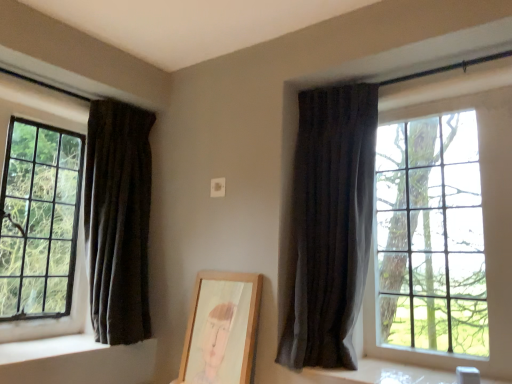
Question: Can you see wooden picture frame at center touching dark fabric curtain at left, which is the second curtain in right-to-left order?

Choices:
 (A) no
 (B) yes

Answer: (A)

Question: Is wooden picture frame at center behind dark fabric curtain at left, arranged as the 1th curtain when viewed from the left?

Choices:
 (A) yes
 (B) no

Answer: (B)

Question: Can you confirm if wooden picture frame at center is taller than dark fabric curtain at left, which is the second curtain in right-to-left order?

Choices:
 (A) yes
 (B) no

Answer: (B)

Question: From a real-world perspective, is wooden picture frame at center over dark fabric curtain at left, arranged as the 1th curtain when viewed from the left?

Choices:
 (A) no
 (B) yes

Answer: (A)

Question: Is wooden picture frame at center far from dark fabric curtain at left, arranged as the 1th curtain when viewed from the left?

Choices:
 (A) yes
 (B) no

Answer: (B)

Question: In the image, is white smooth window sill at lower left, which is the first window sill in left-to-right order, positioned in front of or behind clear glass window at right, the 2th window from the left?

Choices:
 (A) front
 (B) behind

Answer: (B)

Question: From the image's perspective, is white smooth window sill at lower left, which is the first window sill in left-to-right order, located above or below clear glass window at right, the 2th window from the left?

Choices:
 (A) below
 (B) above

Answer: (A)

Question: Do you think white smooth window sill at lower left, placed as the second window sill when sorted from right to left, is within clear glass window at right, the 2th window from the left, or outside of it?

Choices:
 (A) inside
 (B) outside

Answer: (B)

Question: Considering the positions of point (96, 342) and point (487, 97), is point (96, 342) closer or farther from the camera than point (487, 97)?

Choices:
 (A) farther
 (B) closer

Answer: (A)

Question: From their relative heights in the image, would you say white smooth window sill at lower right, the first window sill positioned from the right, is taller or shorter than clear glass window at right, which appears as the 1th window when viewed from the right?

Choices:
 (A) short
 (B) tall

Answer: (A)

Question: Considering their positions, is white smooth window sill at lower right, positioned as the second window sill in left-to-right order, located in front of or behind clear glass window at right, the 2th window from the left?

Choices:
 (A) front
 (B) behind

Answer: (A)

Question: From a real-world perspective, is white smooth window sill at lower right, the first window sill positioned from the right, positioned above or below clear glass window at right, the 2th window from the left?

Choices:
 (A) below
 (B) above

Answer: (A)

Question: Does point (310, 372) appear closer or farther from the camera than point (287, 187)?

Choices:
 (A) closer
 (B) farther

Answer: (A)

Question: Is point (145, 258) closer or farther from the camera than point (376, 112)?

Choices:
 (A) closer
 (B) farther

Answer: (B)

Question: Is dark fabric curtain at left, arranged as the 1th curtain when viewed from the left, inside or outside of dark fabric curtain at right, marked as the second curtain in a left-to-right arrangement?

Choices:
 (A) inside
 (B) outside

Answer: (B)